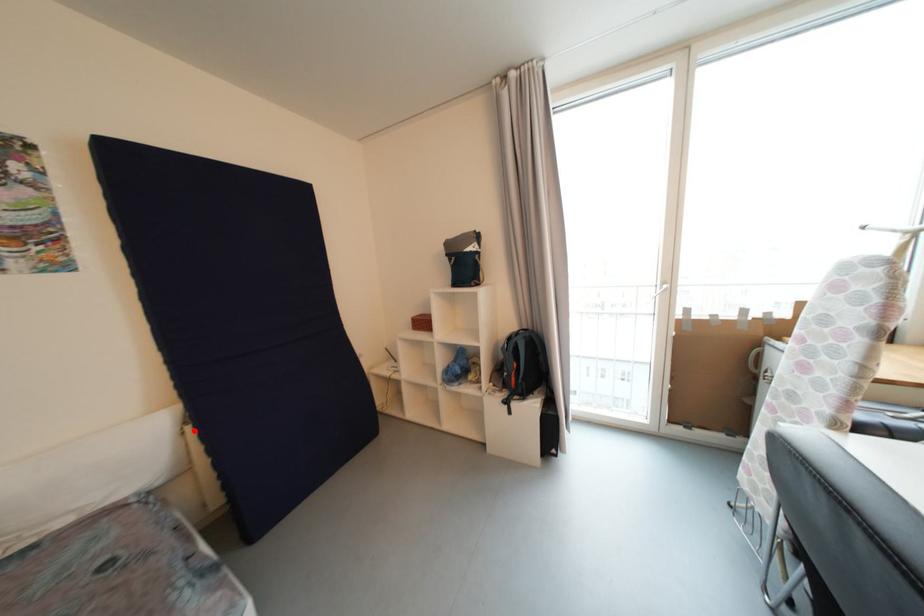
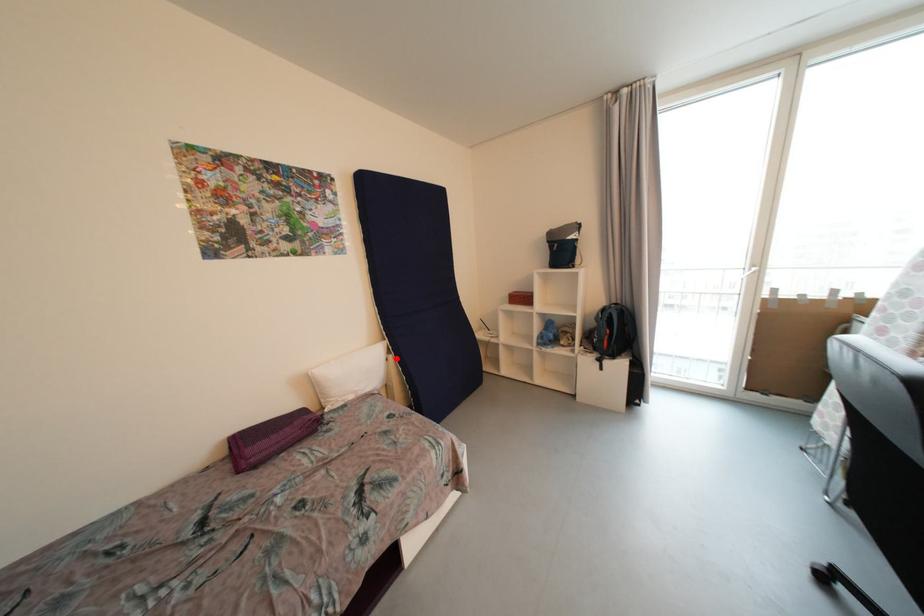
I am providing you with two images of the same scene from different viewpoints. A red point is marked on the first image and another point is marked on the second image. Does the point marked in image1 correspond to the same location as the one in image2?

Yes